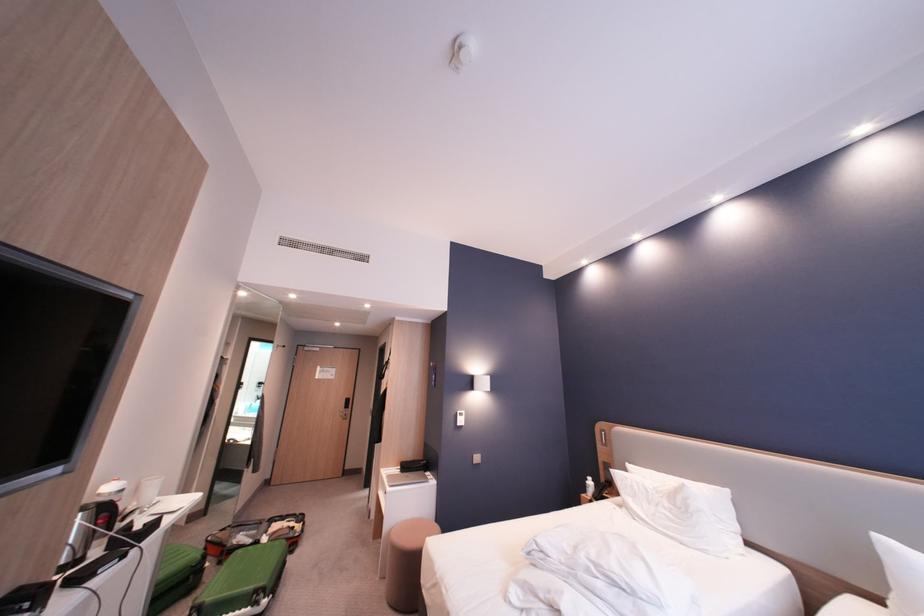
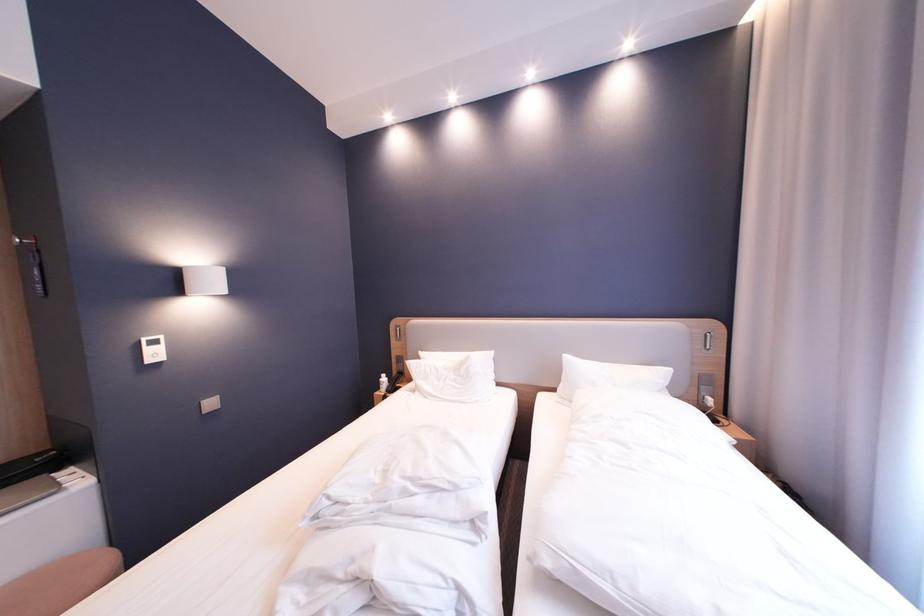
Find the pixel in the second image that matches (x=432, y=464) in the first image.

(51, 460)